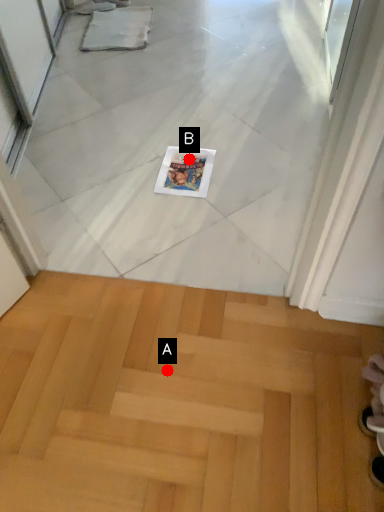
Question: Two points are circled on the image, labeled by A and B beside each circle. Which point is closer to the camera taking this photo?

Choices:
 (A) A is closer
 (B) B is closer

Answer: (A)